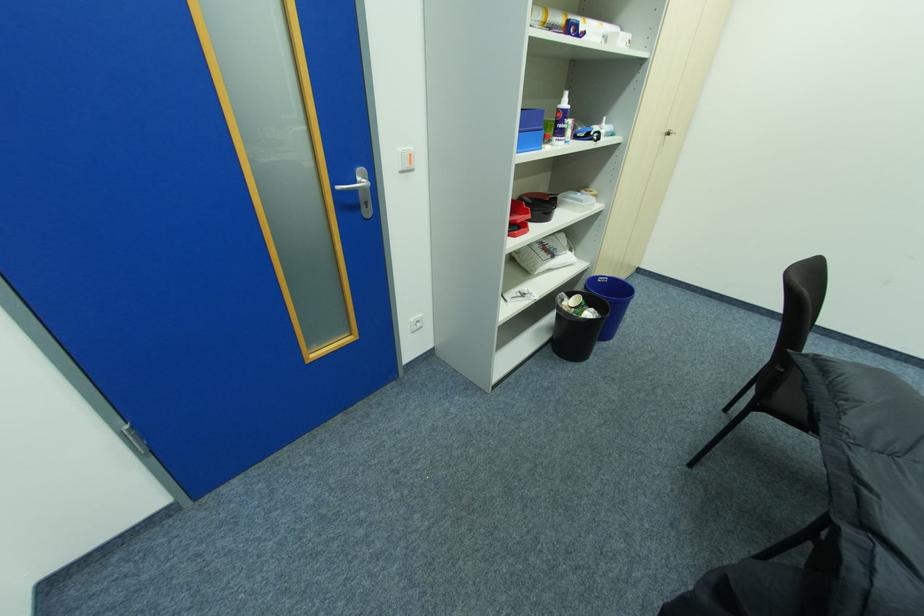
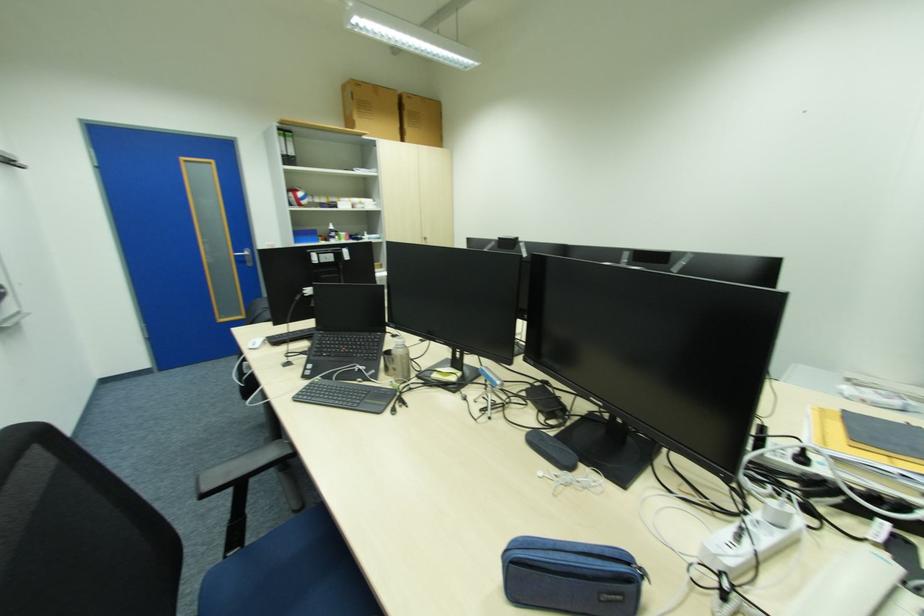
The images are taken continuously from a first-person perspective. In which direction are you moving?

The movement direction of the cameraman is right, backward.